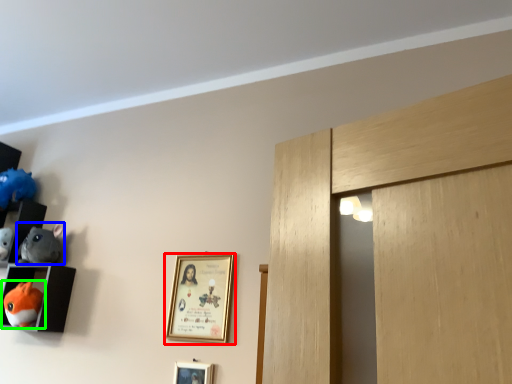
Question: Which object is the closest to the picture frame (highlighted by a red box)? Choose among these: toy (highlighted by a blue box) or toy (highlighted by a green box).

Choices:
 (A) toy
 (B) toy

Answer: (B)